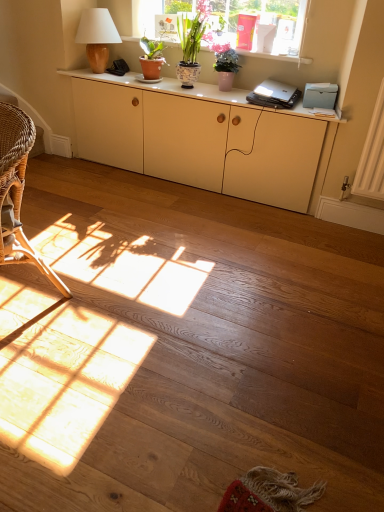
I want to click on matte terracotta pot at upper center, the first houseplant viewed from the left, so click(151, 58).

Where is `matte ceramic pots at upper center`? matte ceramic pots at upper center is located at coordinates (276, 57).

Is woven rattan chair at left oriented towards matte white cabinet at upper center?

No, woven rattan chair at left does not turn towards matte white cabinet at upper center.

Is woven rattan chair at left behind matte white cabinet at upper center?

No, woven rattan chair at left is in front of matte white cabinet at upper center.

Can you confirm if woven rattan chair at left is thinner than matte white cabinet at upper center?

Incorrect, the width of woven rattan chair at left is not less than that of matte white cabinet at upper center.

From a real-world perspective, between matte white cabinet at upper center and woven rattan chair at left, who is vertically lower?

woven rattan chair at left, from a real-world perspective.

Find the location of `chair on the left side of matte white cabinet at upper center`. chair on the left side of matte white cabinet at upper center is located at coordinates (17, 191).

Can you confirm if matte white cabinet at upper center is positioned to the right of woven rattan chair at left?

Indeed, matte white cabinet at upper center is positioned on the right side of woven rattan chair at left.

Is matte white cabinet at upper center next to woven rattan chair at left and touching it?

matte white cabinet at upper center and woven rattan chair at left are not in contact.

In the image, is matte white cabinet at upper center positioned in front of or behind matte cream cabinet at center?

Visually, matte white cabinet at upper center is located in front of matte cream cabinet at center.

Considering the sizes of objects matte white cabinet at upper center and matte cream cabinet at center in the image provided, who is taller, matte white cabinet at upper center or matte cream cabinet at center?

matte cream cabinet at center is taller.

Does point (85, 74) appear closer or farther from the camera than point (312, 151)?

Point (85, 74) is positioned farther from the camera compared to point (312, 151).

Is matte terracotta pot at upper center, positioned as the 3th houseplant in right-to-left order, wider or thinner than woven rattan chair at left?

Considering their sizes, matte terracotta pot at upper center, positioned as the 3th houseplant in right-to-left order, looks slimmer than woven rattan chair at left.

Is woven rattan chair at left at the back of matte terracotta pot at upper center, positioned as the 3th houseplant in right-to-left order?

No, matte terracotta pot at upper center, positioned as the 3th houseplant in right-to-left order, is not facing the opposite direction of woven rattan chair at left.

Which is more to the left, matte terracotta pot at upper center, the first houseplant viewed from the left, or woven rattan chair at left?

woven rattan chair at left is more to the left.

From the image's perspective, is matte terracotta pot at upper center, the first houseplant viewed from the left, located above woven rattan chair at left?

Indeed, from the image's perspective, matte terracotta pot at upper center, the first houseplant viewed from the left, is shown above woven rattan chair at left.

In the scene shown: Considering the sizes of objects matte cream cabinet at center and matte terracotta pot at upper center, positioned as the 3th houseplant in right-to-left order, in the image provided, who is taller, matte cream cabinet at center or matte terracotta pot at upper center, positioned as the 3th houseplant in right-to-left order,?

matte cream cabinet at center is taller.

Does matte cream cabinet at center touch matte terracotta pot at upper center, positioned as the 3th houseplant in right-to-left order?

No, matte cream cabinet at center is not beside matte terracotta pot at upper center, positioned as the 3th houseplant in right-to-left order.

Between matte cream cabinet at center and matte terracotta pot at upper center, the first houseplant viewed from the left, which one is positioned in front?

matte cream cabinet at center is closer to the camera.

From a real-world perspective, between matte cream cabinet at center and matte terracotta pot at upper center, the first houseplant viewed from the left, who is vertically lower?

matte cream cabinet at center, from a real-world perspective.

Is point (136, 38) less distant than point (10, 166)?

No.

Relative to woven rattan chair at left, is matte ceramic pots at upper center in front or behind?

matte ceramic pots at upper center is positioned farther from the viewer than woven rattan chair at left.

From the image's perspective, relative to woven rattan chair at left, is matte ceramic pots at upper center above or below?

matte ceramic pots at upper center is situated higher than woven rattan chair at left in the image.

Is woven rattan chair at left closer to the viewer compared to matte wood lamp at upper left?

Yes, woven rattan chair at left is closer to the camera.

Can you confirm if woven rattan chair at left is thinner than matte wood lamp at upper left?

No.

Looking at this image, from a real-world perspective, which is physically above, woven rattan chair at left or matte wood lamp at upper left?

matte wood lamp at upper left is physically above.

Considering the sizes of objects woven rattan chair at left and matte wood lamp at upper left in the image provided, who is shorter, woven rattan chair at left or matte wood lamp at upper left?

matte wood lamp at upper left is shorter.

Where is `chair that appears below the matte white cabinet at upper center (from the image's perspective)`? The height and width of the screenshot is (512, 384). chair that appears below the matte white cabinet at upper center (from the image's perspective) is located at coordinates (17, 191).

Find the location of a particular element. This screenshot has height=512, width=384. desk located above the woven rattan chair at left (from the image's perspective) is located at coordinates [x=165, y=87].

From the image, which object appears to be nearer to black plastic laptop at center, matte white cabinet at upper center or pink ceramic vase at upper center, which is the first houseplant from right to left?

matte white cabinet at upper center is closer to black plastic laptop at center.

From the image, which object appears to be nearer to matte ceramic pots at upper center, pink ceramic vase at upper center, the third houseplant in the left-to-right sequence, or matte cream cabinet at center?

pink ceramic vase at upper center, the third houseplant in the left-to-right sequence.

Considering their positions, is matte cream cabinet at center positioned further to matte ceramic pots at upper center than matte white cabinet at upper center?

Based on the image, matte cream cabinet at center appears to be further to matte ceramic pots at upper center.

Which object lies nearer to the anchor point matte cream cabinet at center, matte wood lamp at upper left or pink ceramic vase at upper center, which is the first houseplant from right to left?

pink ceramic vase at upper center, which is the first houseplant from right to left.

Considering their positions, is matte cream cabinet at center positioned closer to matte wood lamp at upper left than matte terracotta pot at upper center, positioned as the 3th houseplant in right-to-left order?

matte terracotta pot at upper center, positioned as the 3th houseplant in right-to-left order, is closer to matte wood lamp at upper left.

Estimate the real-world distances between objects in this image. Which object is further from black plastic laptop at center, matte cream cabinet at center or matte white cabinet at upper center?

Among the two, matte cream cabinet at center is located further to black plastic laptop at center.

From the image, which object appears to be nearer to matte terracotta pot at upper center, the first houseplant viewed from the left, black plastic laptop at center or woven rattan chair at left?

black plastic laptop at center lies closer to matte terracotta pot at upper center, the first houseplant viewed from the left, than the other object.

When comparing their distances from textured ceramic pot at upper center, the 2th houseplant in the left-to-right sequence, does matte white cabinet at upper center or matte ceramic pots at upper center seem further?

matte ceramic pots at upper center lies further to textured ceramic pot at upper center, the 2th houseplant in the left-to-right sequence, than the other object.

Where is `window sill located between textured ceramic pot at upper center, the 2th houseplant in the left-to-right sequence, and black plastic laptop at center in the left-right direction`? This screenshot has width=384, height=512. window sill located between textured ceramic pot at upper center, the 2th houseplant in the left-to-right sequence, and black plastic laptop at center in the left-right direction is located at coordinates (276, 57).

The width and height of the screenshot is (384, 512). What are the coordinates of `window sill between matte terracotta pot at upper center, the first houseplant viewed from the left, and pink ceramic vase at upper center, which is the first houseplant from right to left, in the horizontal direction` in the screenshot? It's located at (276, 57).

Locate an element on the screen. cabinetry situated between matte wood lamp at upper left and black plastic laptop at center from left to right is located at coordinates (201, 138).

Find the location of `houseplant situated between matte wood lamp at upper left and matte white cabinet at upper center from left to right`. houseplant situated between matte wood lamp at upper left and matte white cabinet at upper center from left to right is located at coordinates (151, 58).